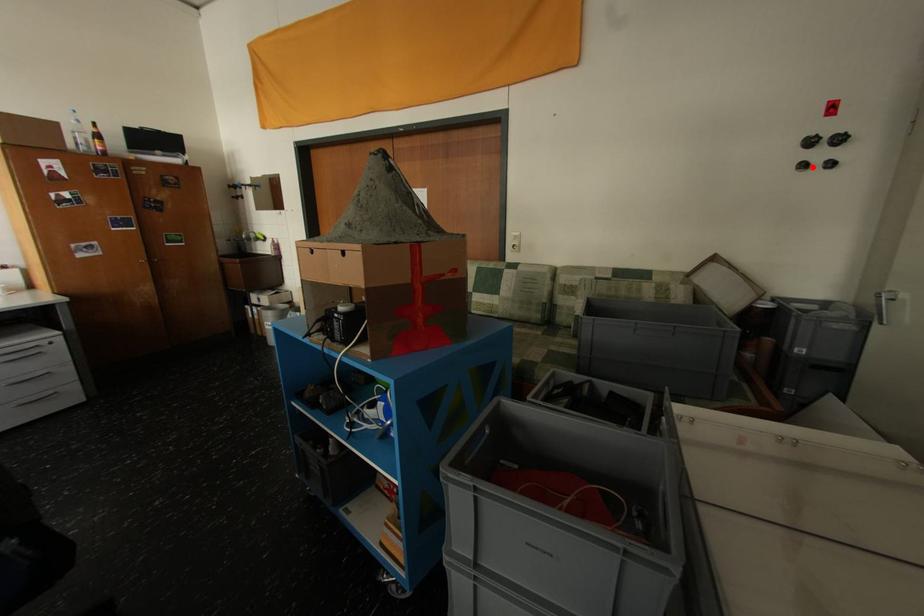
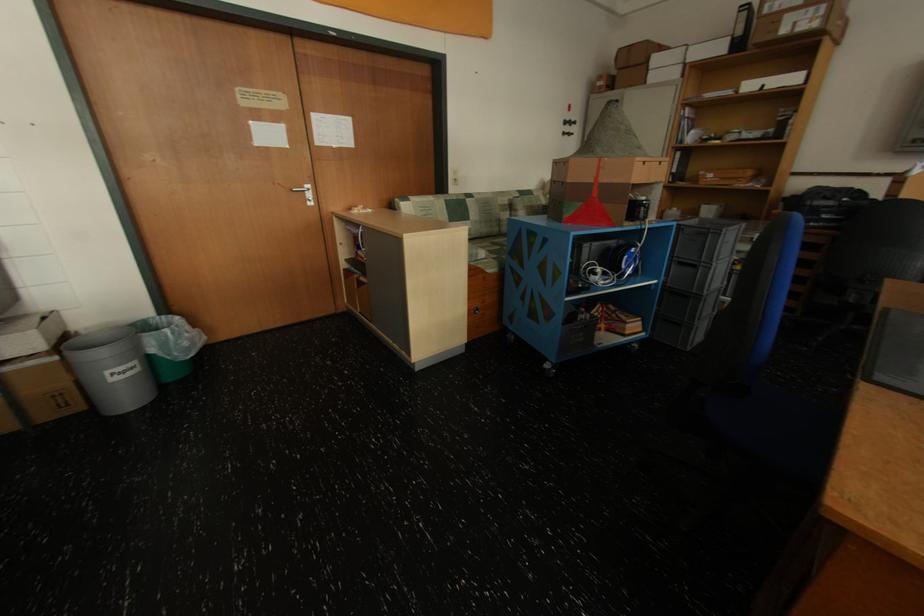
Locate, in the second image, the point that corresponds to the highlighted location in the first image.

(573, 135)